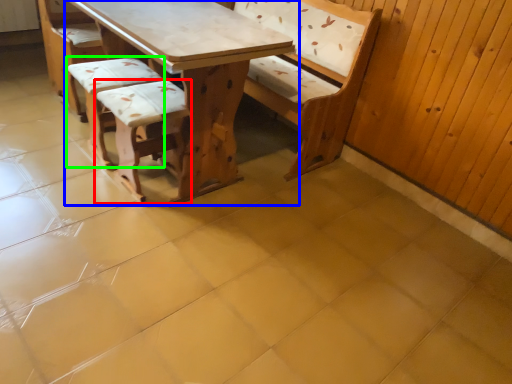
Question: Considering the real-world distances, which object is closest to armchair (highlighted by a red box)? table (highlighted by a blue box) or armchair (highlighted by a green box).

Choices:
 (A) table
 (B) armchair

Answer: (A)